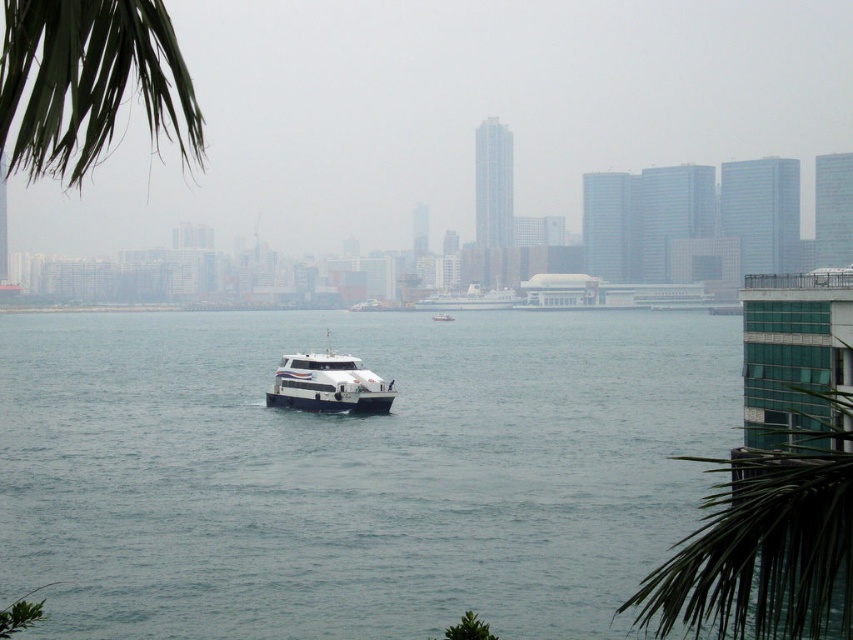
You are a photographer trying to capture the white glossy boat at center and the green leafy palm tree at lower right in the same frame. Which object appears wider in the photo?

The green leafy palm tree at lower right appears wider than the white glossy boat at center because its width surpasses the boat.

You are standing at the waterfront and want to locate two points marked in the scene. The first point is at coordinates point (45, 20) and the second is at point (281, 376). Which point is nearer to you?

Result: Point (45, 20) is closer to the viewer than point (281, 376).